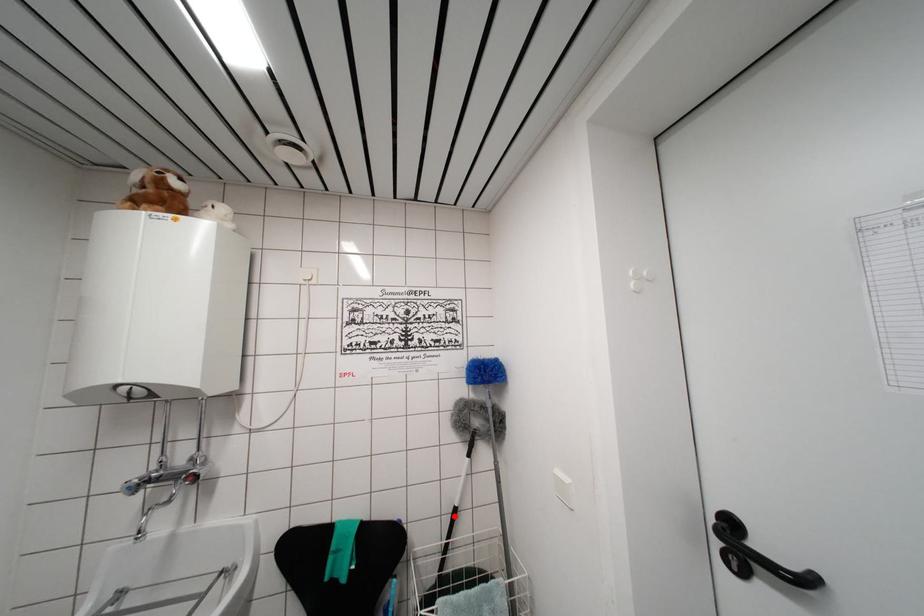
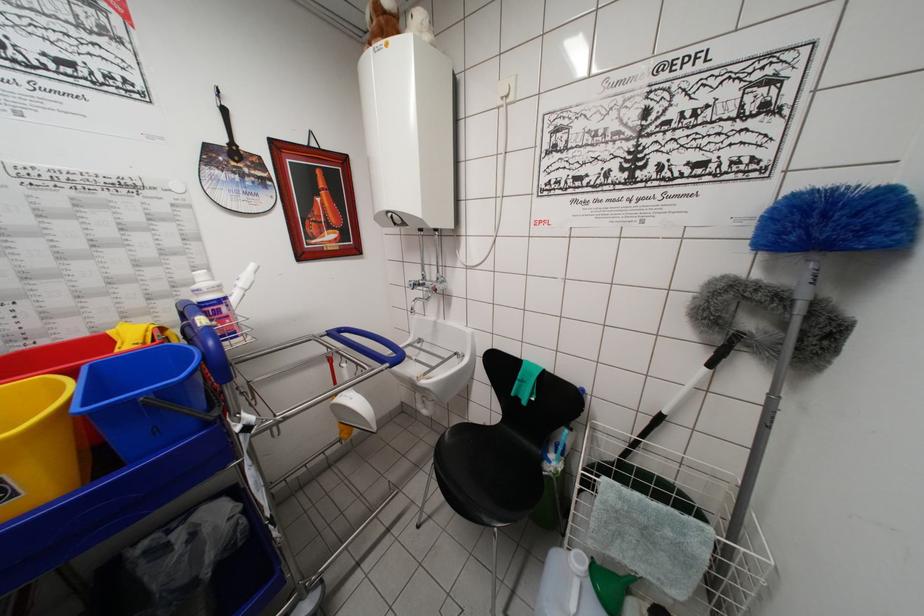
Where in the second image is the point corresponding to the highlighted location from the first image?

(658, 419)